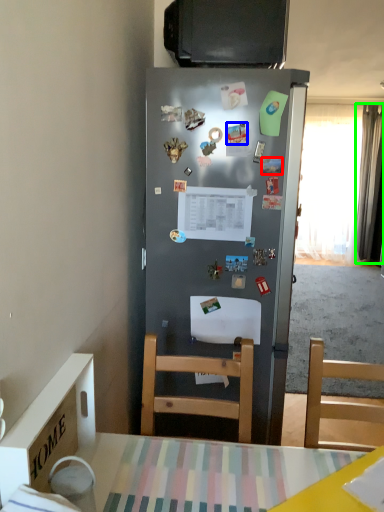
Question: Considering the real-world distances, which object is farthest from magnet (highlighted by a red box)? magnet (highlighted by a blue box) or curtain (highlighted by a green box)?

Choices:
 (A) magnet
 (B) curtain

Answer: (B)